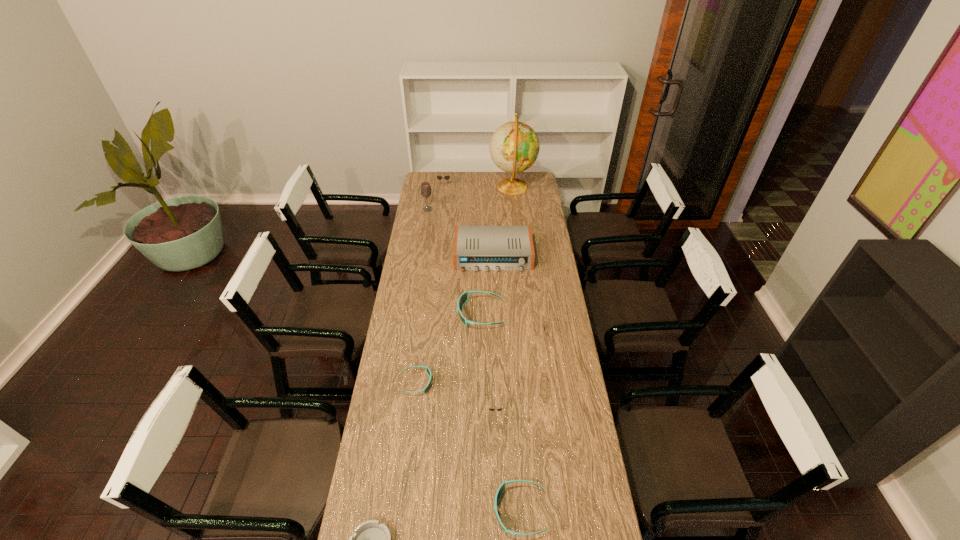
Locate an element on the screen. The height and width of the screenshot is (540, 960). vacant space located in front of the lenses of the second nearest black sunglasses is located at coordinates (447, 333).

At what (x,y) coordinates should I click in order to perform the action: click on blank space located 0.050m in front of the lenses of the second nearest black sunglasses. Please return your answer as a coordinate pair (x, y). Looking at the image, I should click on (530, 333).

Where is `vacant space located 0.080m on the front-facing side of the farthest cyan sunglasses`? Image resolution: width=960 pixels, height=540 pixels. vacant space located 0.080m on the front-facing side of the farthest cyan sunglasses is located at coordinates (440, 314).

The image size is (960, 540). Find the location of `vacant space positioned on the front-facing side of the farthest cyan sunglasses`. vacant space positioned on the front-facing side of the farthest cyan sunglasses is located at coordinates (413, 314).

Identify the location of vacant position located 0.090m on the front-facing side of the farthest cyan sunglasses. The image size is (960, 540). (437, 314).

The image size is (960, 540). In order to click on vacant position located 0.050m in front of the lenses of the second nearest sunglasses in this screenshot , I will do `click(496, 430)`.

Locate an element on the screen. Image resolution: width=960 pixels, height=540 pixels. free location located 0.290m on the front-facing side of the nearest cyan sunglasses is located at coordinates (400, 511).

Where is `vacant space situated 0.230m on the front-facing side of the nearest cyan sunglasses`? vacant space situated 0.230m on the front-facing side of the nearest cyan sunglasses is located at coordinates (420, 511).

At what (x,y) coordinates should I click in order to perform the action: click on vacant space located on the front-facing side of the nearest cyan sunglasses. Please return your answer as a coordinate pair (x, y). Looking at the image, I should click on (377, 511).

Locate an element on the screen. The image size is (960, 540). blank space located on the front-facing side of the leftmost cyan sunglasses is located at coordinates (464, 383).